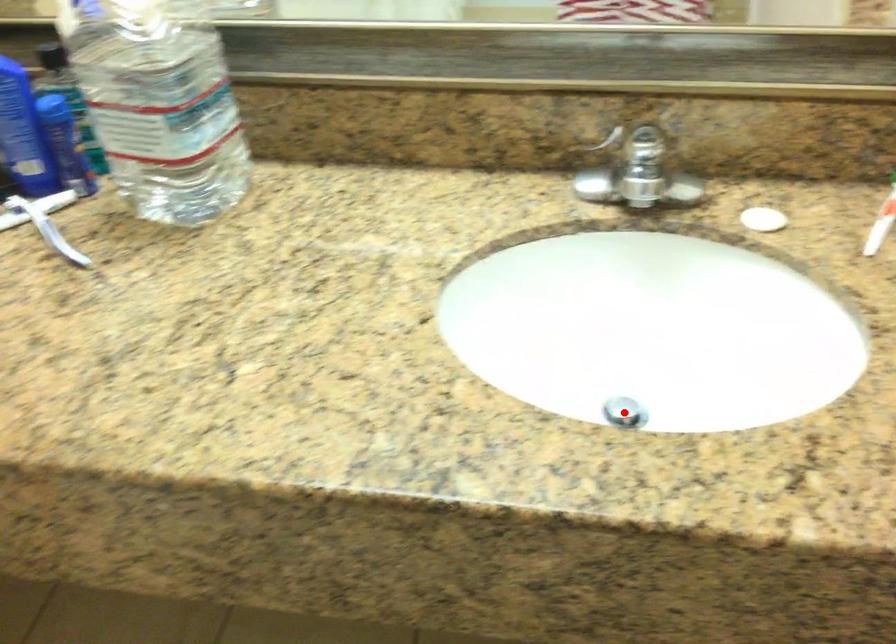
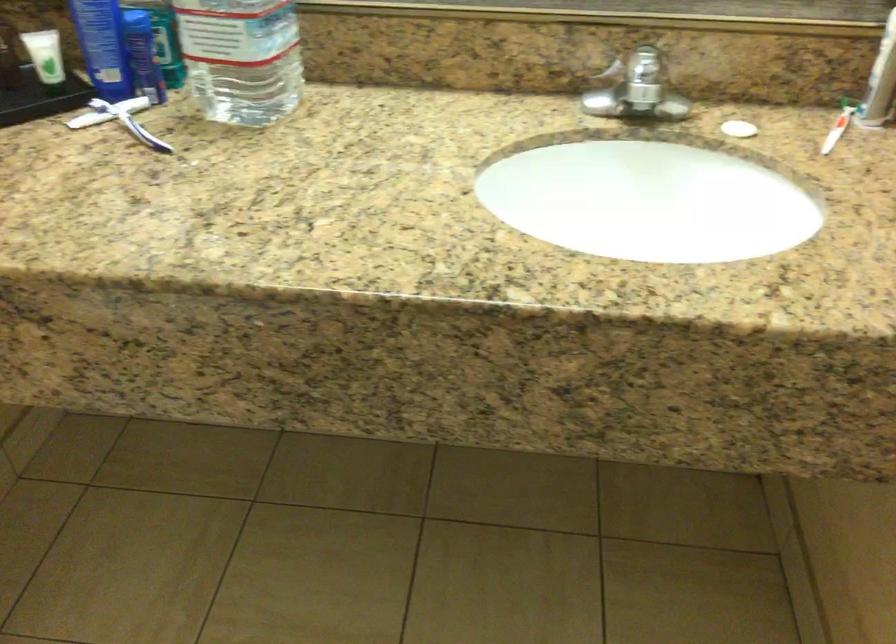
Question: I am providing you with two images of the same scene from different viewpoints. A red point is marked on the first image. Can you still see the location of the red point in image 2?

Choices:
 (A) Yes
 (B) No

Answer: (B)